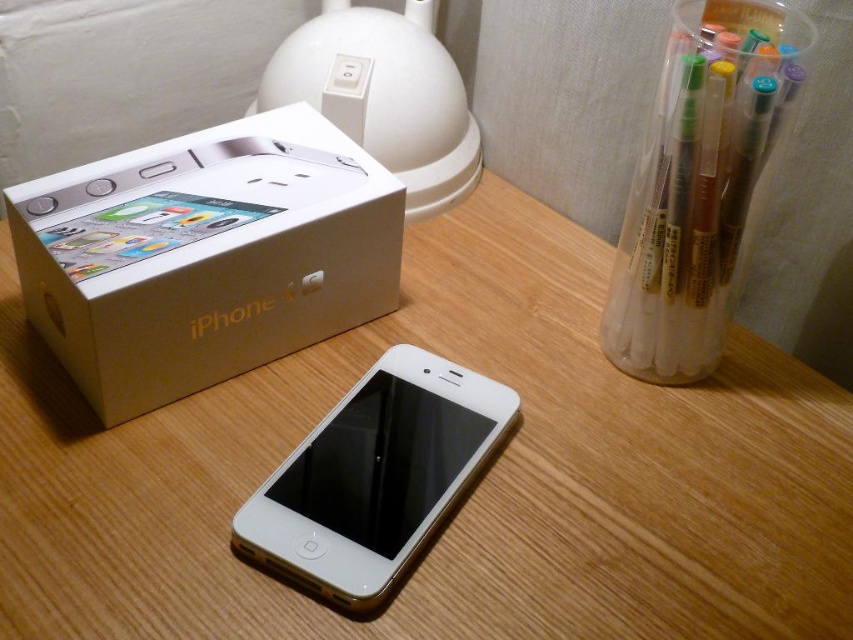
Can you confirm if white cardboard iphone box at upper left is positioned below clear plastic pen at upper right?

Indeed, white cardboard iphone box at upper left is positioned under clear plastic pen at upper right.

Which is in front, point (109, 387) or point (757, 3)?

Point (757, 3)

Find the location of a particular element. white cardboard iphone box at upper left is located at coordinates (206, 256).

Does white cardboard iphone box at upper left appear on the left side of white glossy ipod at center?

Indeed, white cardboard iphone box at upper left is positioned on the left side of white glossy ipod at center.

Can you confirm if white cardboard iphone box at upper left is thinner than white glossy ipod at center?

No, white cardboard iphone box at upper left is not thinner than white glossy ipod at center.

Measure the distance between white cardboard iphone box at upper left and camera.

The distance of white cardboard iphone box at upper left from camera is 32.87 inches.

In order to click on white cardboard iphone box at upper left in this screenshot , I will do tap(206, 256).

Between point (718, 484) and point (409, 490), which one is positioned in front?

Point (409, 490) is more forward.

Who is more forward, (62, 445) or (318, 497)?

Point (318, 497) is in front.

This screenshot has width=853, height=640. In order to click on wooden table at center in this screenshot , I will do `click(473, 492)`.